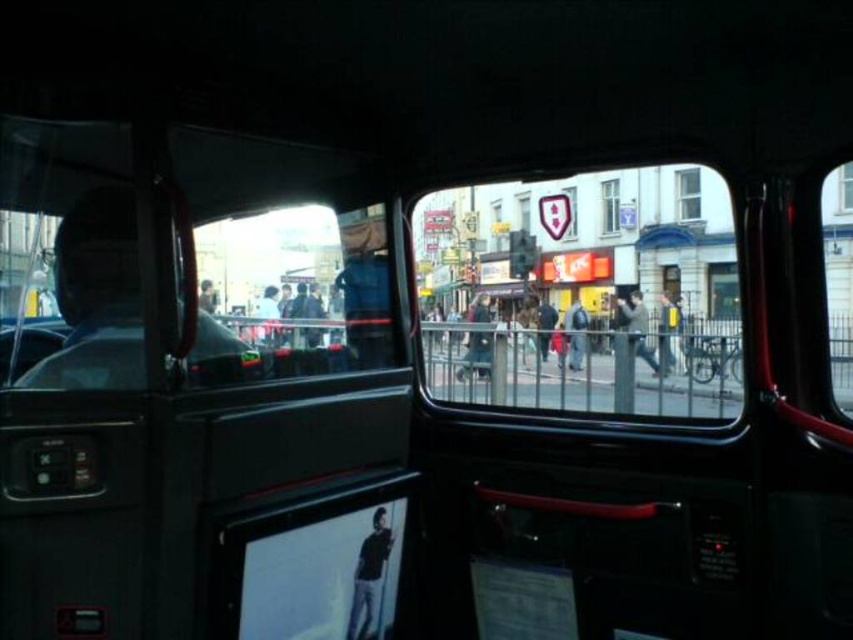
How far apart are matte black crowd at center and transparent glass window at center?

The distance of matte black crowd at center from transparent glass window at center is 10.89 meters.

Can you confirm if matte black crowd at center is bigger than transparent glass window at center?

No.

Looking at this image, who is more forward, (456, 332) or (843, 172)?

Positioned in front is point (843, 172).

You are a GUI agent. You are given a task and a screenshot of the screen. Output one action in this format:
    pyautogui.click(x=<x>, y=<y>)
    Task: Click on the matte black crowd at center
    The height and width of the screenshot is (640, 853).
    Given the screenshot: What is the action you would take?
    point(561,339)

Which is in front, point (618, 304) or point (850, 184)?

Point (850, 184) is in front.

Is point (619, 298) farther from camera compared to point (836, 184)?

Yes, point (619, 298) is behind point (836, 184).

Which is behind, point (654, 358) or point (840, 186)?

The point (840, 186) is behind.

Identify the location of dark gray jacket at center. The image size is (853, 640). (637, 326).

Is clear glass bus window at center in front of clear glass window at upper center?

Yes, clear glass bus window at center is closer to the viewer.

Does clear glass bus window at center appear over clear glass window at upper center?

Actually, clear glass bus window at center is below clear glass window at upper center.

Between point (631, 269) and point (689, 186), which one is positioned behind?

Positioned behind is point (631, 269).

In order to click on clear glass bus window at center in this screenshot , I will do `click(582, 294)`.